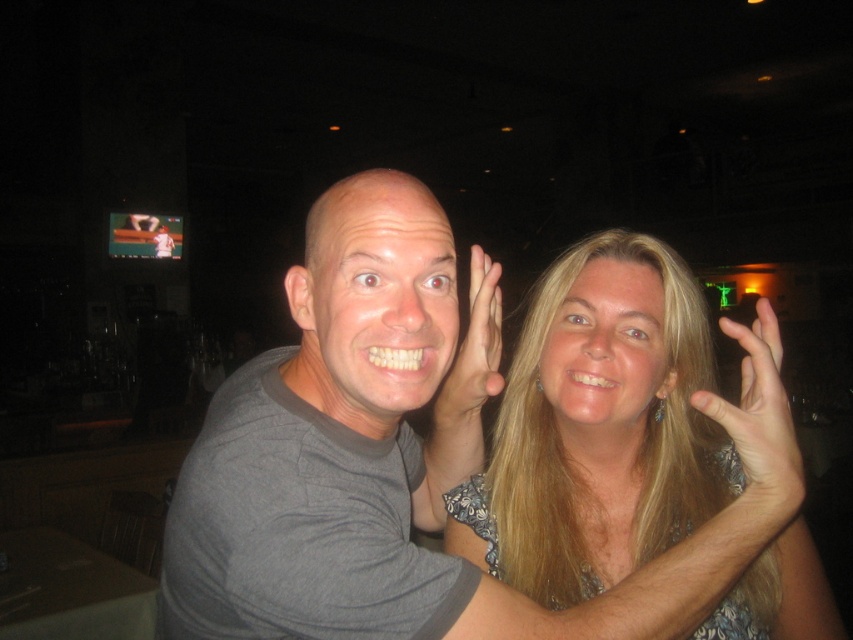
Measure the distance between gray fabric couple at center and matte skin hand at center.

gray fabric couple at center is 20.23 centimeters from matte skin hand at center.

Can you confirm if gray fabric couple at center is positioned to the left of matte skin hand at center?

Yes, gray fabric couple at center is to the left of matte skin hand at center.

Is point (355, 237) in front of point (465, 408)?

Yes, it is.

Locate an element on the screen. gray fabric couple at center is located at coordinates (410, 464).

Consider the image. Who is more forward, (675, 554) or (781, 432)?

Point (675, 554)

The height and width of the screenshot is (640, 853). What do you see at coordinates (410, 464) in the screenshot? I see `gray fabric couple at center` at bounding box center [410, 464].

At what (x,y) coordinates should I click in order to perform the action: click on gray fabric couple at center. Please return your answer as a coordinate pair (x, y). Looking at the image, I should click on (410, 464).

In the scene shown: Can you confirm if blonde hair at center is bigger than matte skin hand at center?

Yes.

Which is more to the right, blonde hair at center or matte skin hand at center?

Positioned to the right is blonde hair at center.

Is point (639, 396) positioned behind point (479, 310)?

No.

The height and width of the screenshot is (640, 853). Identify the location of blonde hair at center. (599, 428).